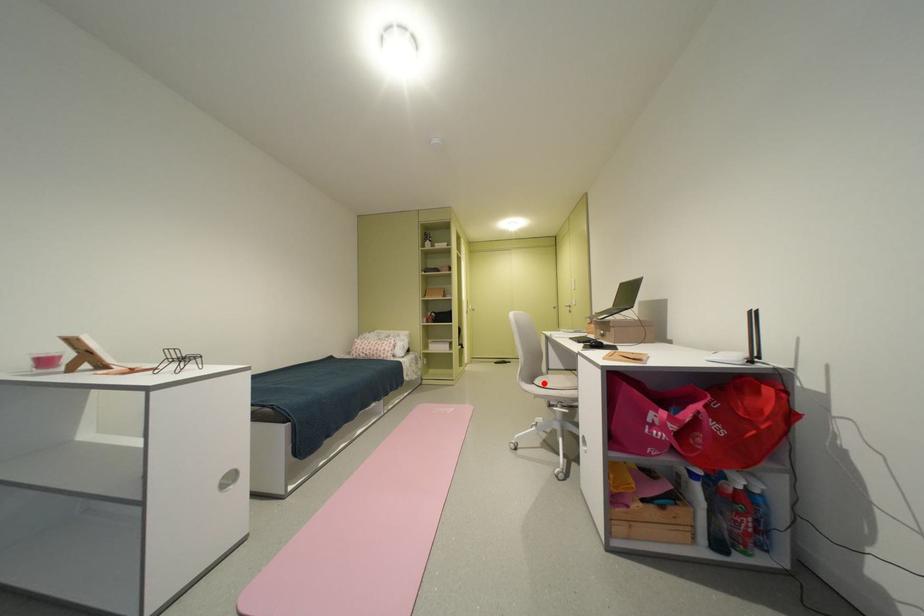
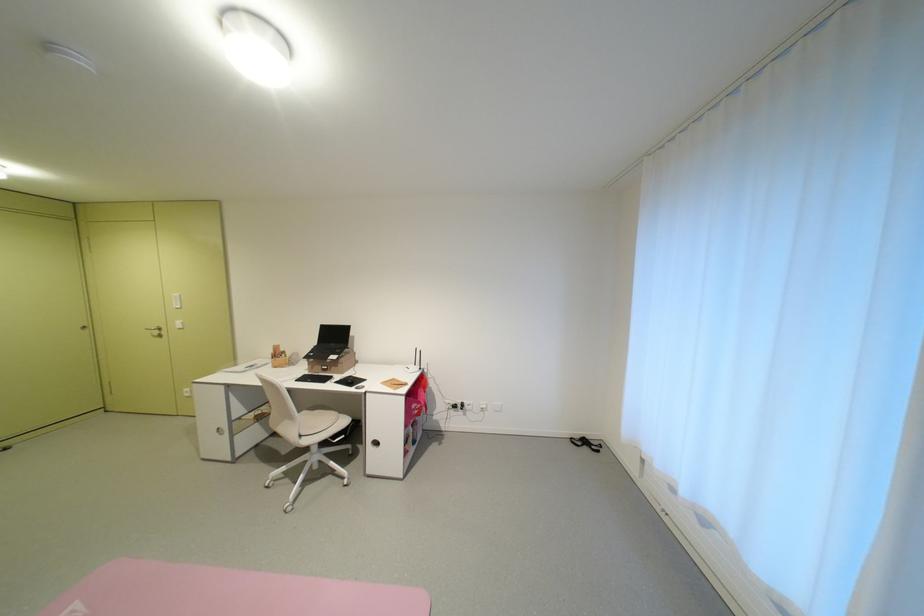
In the second image, find the point that corresponds to the highlighted location in the first image.

(311, 436)